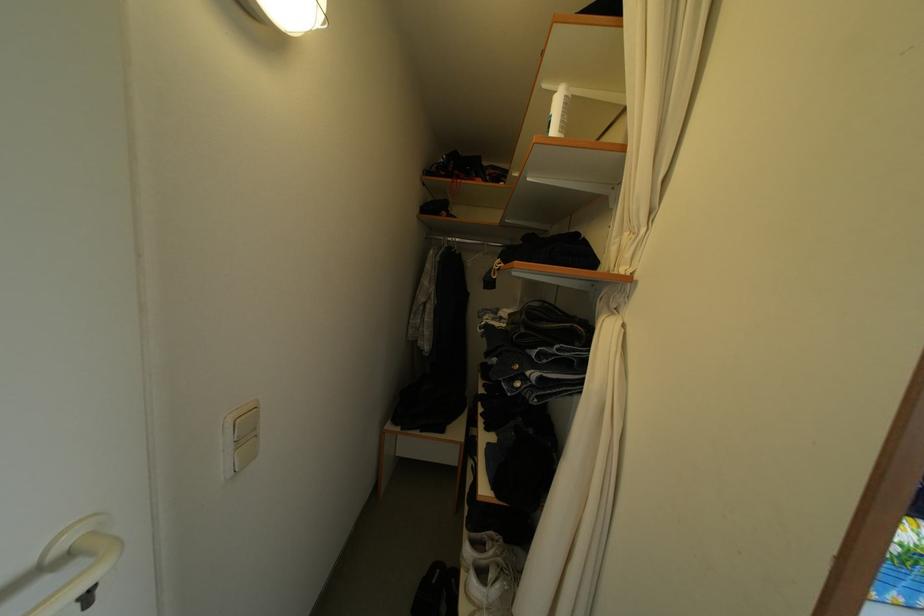
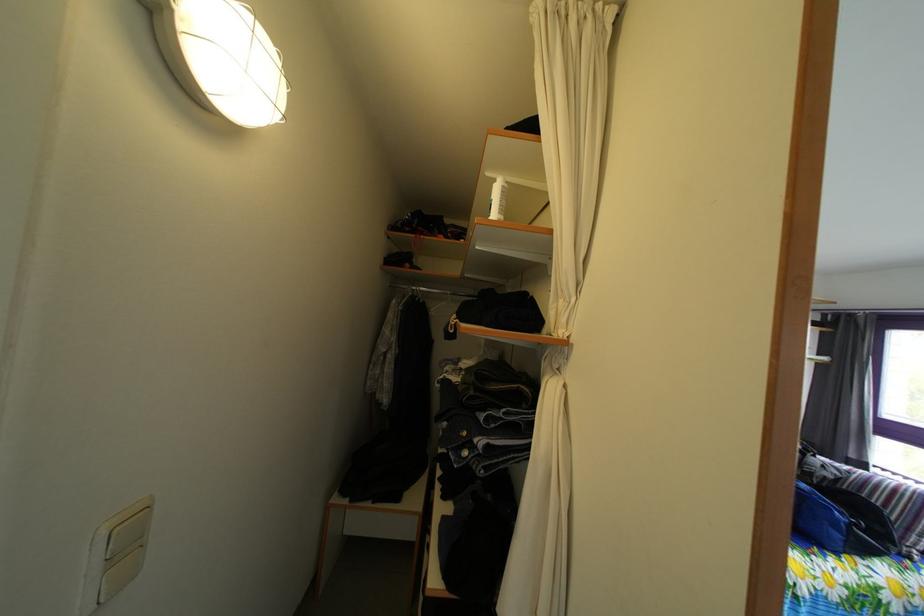
Locate, in the second image, the point that corresponds to pixel 601 355 in the first image.

(545, 416)